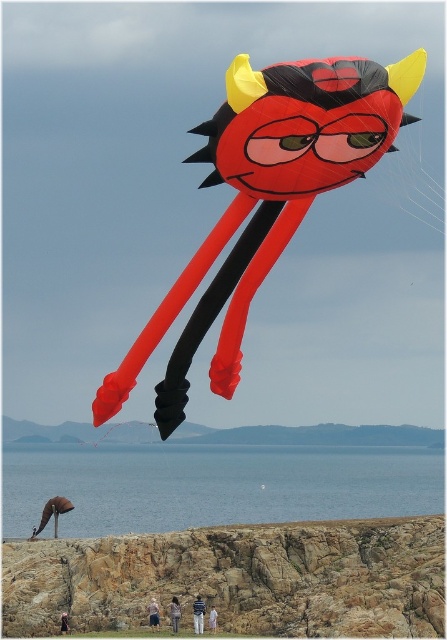
Does denim pants at lower center have a lesser height compared to white cotton shirt at lower center?

In fact, denim pants at lower center may be taller than white cotton shirt at lower center.

Is denim pants at lower center above white cotton shirt at lower center?

Correct, denim pants at lower center is located above white cotton shirt at lower center.

Is point (174, 620) positioned after point (214, 628)?

Yes, it is.

Locate an element on the screen. The width and height of the screenshot is (447, 640). denim pants at lower center is located at coordinates (174, 612).

Which is behind, point (266, 237) or point (177, 604)?

The point (177, 604) is behind.

Can you confirm if matte plastic kite at upper center is positioned to the right of denim pants at lower center?

Yes, matte plastic kite at upper center is to the right of denim pants at lower center.

The height and width of the screenshot is (640, 447). What do you see at coordinates (265, 198) in the screenshot?
I see `matte plastic kite at upper center` at bounding box center [265, 198].

The height and width of the screenshot is (640, 447). Identify the location of matte plastic kite at upper center. (265, 198).

Between light brown hair at lower center and white cotton shirt at lower center, which one has more height?

Standing taller between the two is white cotton shirt at lower center.

Does light brown hair at lower center appear on the right side of white cotton shirt at lower center?

In fact, light brown hair at lower center is to the left of white cotton shirt at lower center.

Which is behind, point (154, 621) or point (210, 616)?

The point (154, 621) is behind.

Where is `light brown hair at lower center`? Image resolution: width=447 pixels, height=640 pixels. light brown hair at lower center is located at coordinates (154, 614).